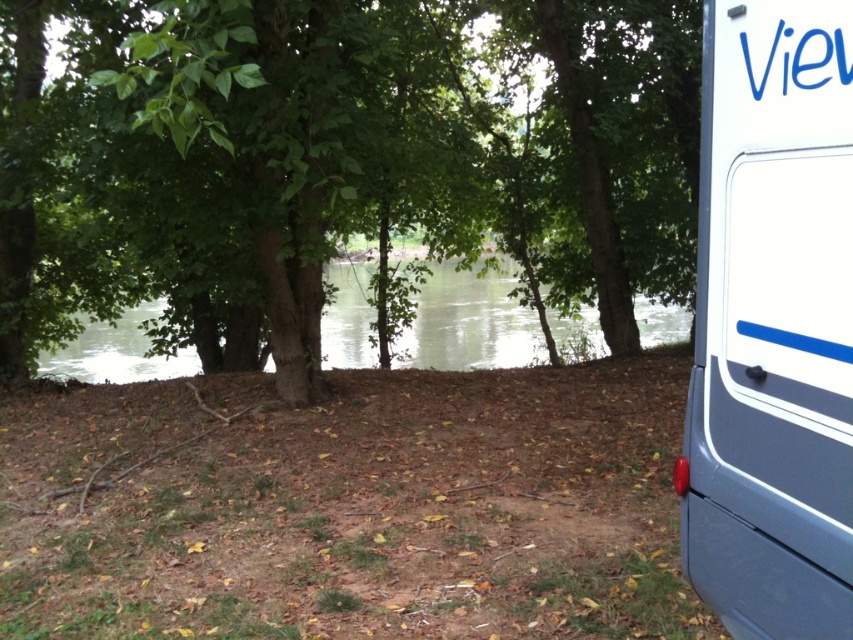
You are a photographer standing on the riverside. You want to take a photo of the green water at center without the white glossy van at right blocking it. Is it possible to do so?

The white glossy van at right is in front of the green water at center, so it is blocking the view. To capture the green water at center without the van, you would need to move to a position where the van is no longer between you and the water.

You are planning to take a photo of the white glossy van at right and the green leafy tree at center from the left side of the image. Which object will appear wider in the photo?

The green leafy tree at center will appear wider in the photo because its width is larger than the white glossy van at right.